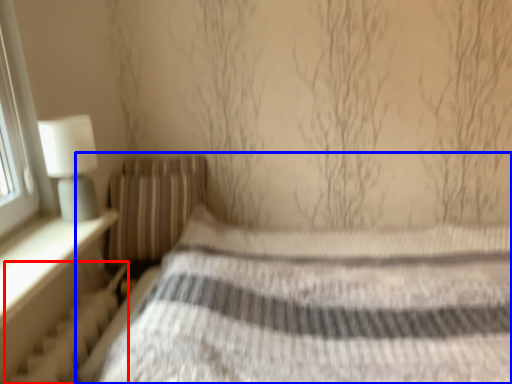
Question: Which object is closer to the camera taking this photo, radiator (highlighted by a red box) or bed (highlighted by a blue box)?

Choices:
 (A) radiator
 (B) bed

Answer: (B)